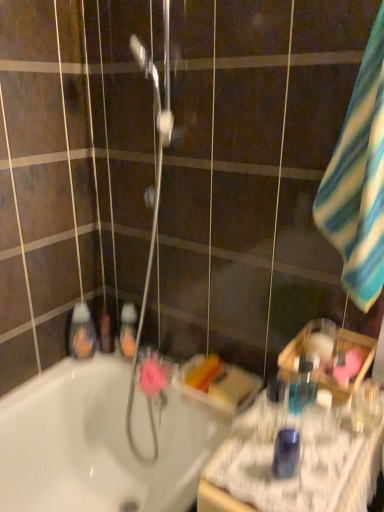
Question: Considering the positions of translucent plastic mouthwash at lower left, which is the fifth mouthwash in right-to-left order, and striped cotton towel at right in the image, is translucent plastic mouthwash at lower left, which is the fifth mouthwash in right-to-left order, bigger or smaller than striped cotton towel at right?

Choices:
 (A) big
 (B) small

Answer: (B)

Question: Is translucent plastic mouthwash at lower left, which is the fifth mouthwash in right-to-left order, in front of or behind striped cotton towel at right in the image?

Choices:
 (A) front
 (B) behind

Answer: (B)

Question: Estimate the real-world distances between objects in this image. Which object is farther from the translucent plastic mouthwash at right, which ranks as the 2th mouthwash in right-to-left order?

Choices:
 (A) translucent plastic mouthwash at lower left, the 1th mouthwash in the back-to-front sequence
 (B) striped cotton towel at right
 (C) blue plastic mouthwash at right, the first mouthwash in the front-to-back sequence
 (D) translucent plastic mouthwash at left, the 5th mouthwash from the front
 (E) translucent orange liquid at center, the fourth mouthwash viewed from the right

Answer: (D)

Question: Estimate the real-world distances between objects in this image. Which object is closer to the translucent plastic mouthwash at lower left, the 1th mouthwash in the back-to-front sequence?

Choices:
 (A) translucent plastic mouthwash at left, marked as the second mouthwash in a back-to-front arrangement
 (B) striped cotton towel at right
 (C) blue plastic mouthwash at right, the first mouthwash in the front-to-back sequence
 (D) clear plastic bottle at right, the fifth mouthwash from the back
 (E) translucent plastic mouthwash at right, acting as the 5th mouthwash starting from the left

Answer: (A)